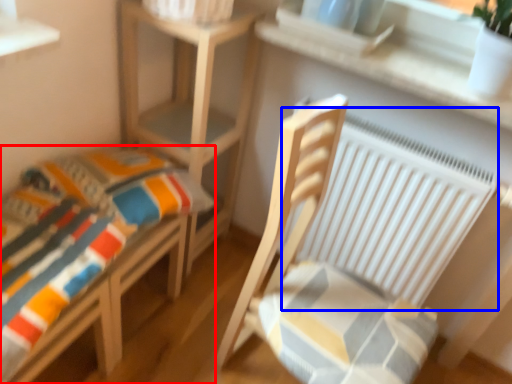
Question: Which point is further to the camera, furniture (highlighted by a red box) or radiator (highlighted by a blue box)?

Choices:
 (A) furniture
 (B) radiator

Answer: (B)